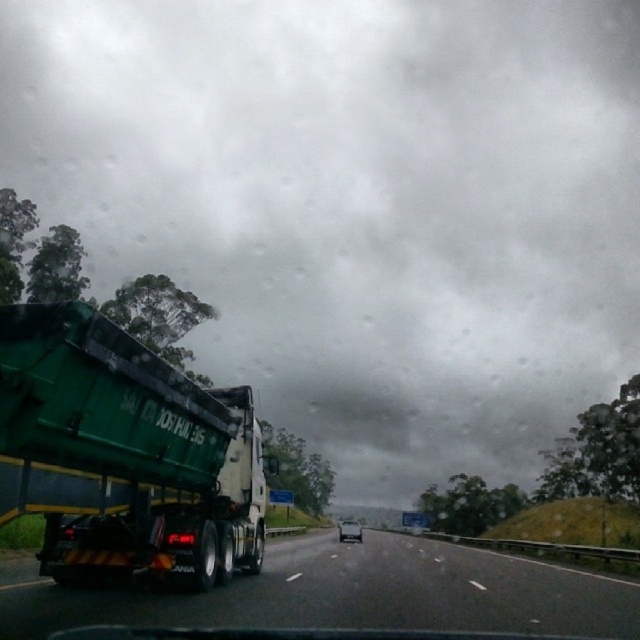
Question: Does green matte truck at left have a smaller size compared to metallic silver sedan at center?

Choices:
 (A) no
 (B) yes

Answer: (B)

Question: Which point is farther from the camera taking this photo?

Choices:
 (A) (90, 364)
 (B) (352, 536)

Answer: (B)

Question: Which object is farther from the camera taking this photo?

Choices:
 (A) metallic silver sedan at center
 (B) green rubber truck at left
 (C) green matte truck at left

Answer: (A)

Question: Which of the following is the closest to the observer?

Choices:
 (A) (4, 358)
 (B) (349, 538)
 (C) (577, 611)

Answer: (A)

Question: Is green rubber truck at left below metallic silver sedan at center?

Choices:
 (A) no
 (B) yes

Answer: (A)

Question: From the image, what is the correct spatial relationship of green matte truck at left in relation to green rubber truck at left?

Choices:
 (A) below
 (B) above

Answer: (B)